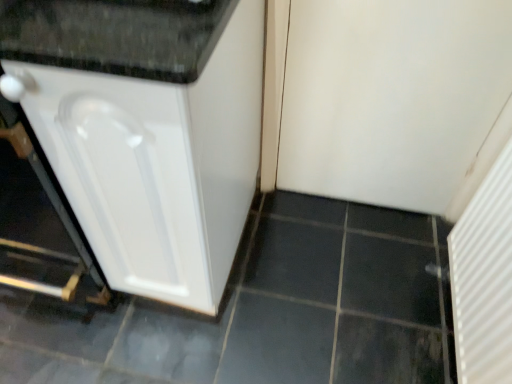
Question: Is white matte door at upper right, arranged as the 2th screen door when ordered from the bottom, positioned in front of white textured radiator at right, the 1th screen door positioned from the bottom?

Choices:
 (A) yes
 (B) no

Answer: (B)

Question: Does white matte door at upper right, arranged as the 2th screen door when ordered from the bottom, have a lesser width compared to white textured radiator at right, the 2th screen door in the top-to-bottom sequence?

Choices:
 (A) no
 (B) yes

Answer: (B)

Question: From the image's perspective, does white matte door at upper right, the first screen door positioned from the top, appear higher than white textured radiator at right, the 2th screen door in the top-to-bottom sequence?

Choices:
 (A) yes
 (B) no

Answer: (A)

Question: Is white matte door at upper right, arranged as the 2th screen door when ordered from the bottom, turned away from white textured radiator at right, the 1th screen door positioned from the bottom?

Choices:
 (A) no
 (B) yes

Answer: (A)

Question: Does white matte door at upper right, arranged as the 2th screen door when ordered from the bottom, have a lesser height compared to white textured radiator at right, the 1th screen door positioned from the bottom?

Choices:
 (A) yes
 (B) no

Answer: (B)

Question: Can you confirm if white matte door at upper right, arranged as the 2th screen door when ordered from the bottom, is wider than white textured radiator at right, the 2th screen door in the top-to-bottom sequence?

Choices:
 (A) no
 (B) yes

Answer: (A)

Question: Considering the relative sizes of white textured radiator at right, the 2th screen door in the top-to-bottom sequence, and white glossy cabinet at left in the image provided, is white textured radiator at right, the 2th screen door in the top-to-bottom sequence, smaller than white glossy cabinet at left?

Choices:
 (A) yes
 (B) no

Answer: (A)

Question: Is white textured radiator at right, the 1th screen door positioned from the bottom, wider than white glossy cabinet at left?

Choices:
 (A) yes
 (B) no

Answer: (B)

Question: Is white textured radiator at right, the 1th screen door positioned from the bottom, oriented towards white glossy cabinet at left?

Choices:
 (A) yes
 (B) no

Answer: (A)

Question: Can you confirm if white textured radiator at right, the 2th screen door in the top-to-bottom sequence, is taller than white glossy cabinet at left?

Choices:
 (A) no
 (B) yes

Answer: (A)

Question: Is white textured radiator at right, the 2th screen door in the top-to-bottom sequence, at the left side of white glossy cabinet at left?

Choices:
 (A) no
 (B) yes

Answer: (A)

Question: Are white textured radiator at right, the 1th screen door positioned from the bottom, and white glossy cabinet at left far apart?

Choices:
 (A) no
 (B) yes

Answer: (A)

Question: Is white matte door at upper right, arranged as the 2th screen door when ordered from the bottom, surrounding white glossy cabinet at left?

Choices:
 (A) yes
 (B) no

Answer: (B)